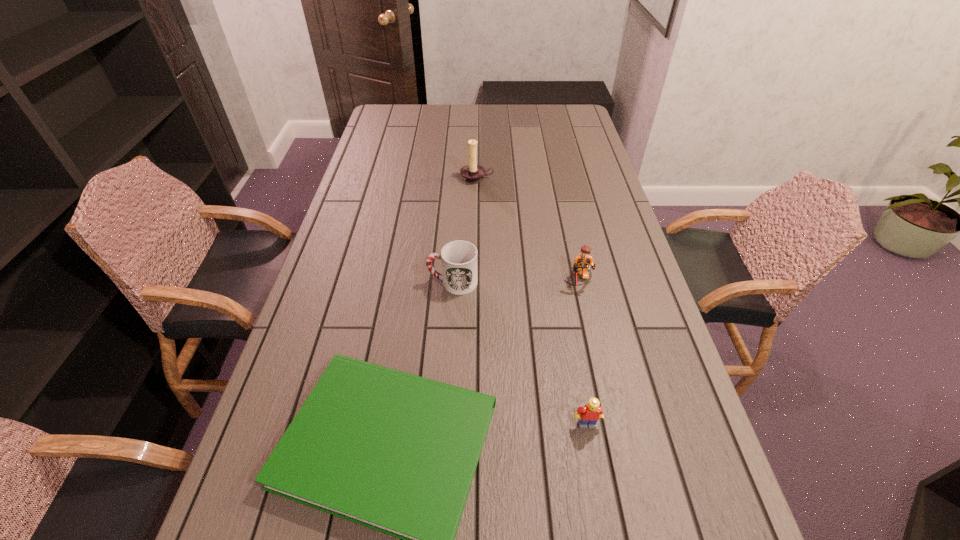
The height and width of the screenshot is (540, 960). I want to click on empty space between the nearer Lego and the farther Lego, so click(583, 353).

Find the location of a particular element. free spot between the tallest object and the nearer Lego is located at coordinates (532, 301).

This screenshot has height=540, width=960. Identify the location of empty location between the farther Lego and the tallest object. (528, 230).

At what (x,y) coordinates should I click in order to perform the action: click on vacant space that is in between the cup and the nearer Lego. Please return your answer as a coordinate pair (x, y). This screenshot has width=960, height=540. Looking at the image, I should click on (519, 353).

Identify which object is located as the fourth nearest to the farthest object. Please provide its 2D coordinates. Your answer should be formatted as a tuple, i.e. [(x, y)], where the tuple contains the x and y coordinates of a point satisfying the conditions above.

[(589, 414)]

At what (x,y) coordinates should I click in order to perform the action: click on object that ranks as the second closest to the farther Lego. Please return your answer as a coordinate pair (x, y). The width and height of the screenshot is (960, 540). Looking at the image, I should click on (395, 452).